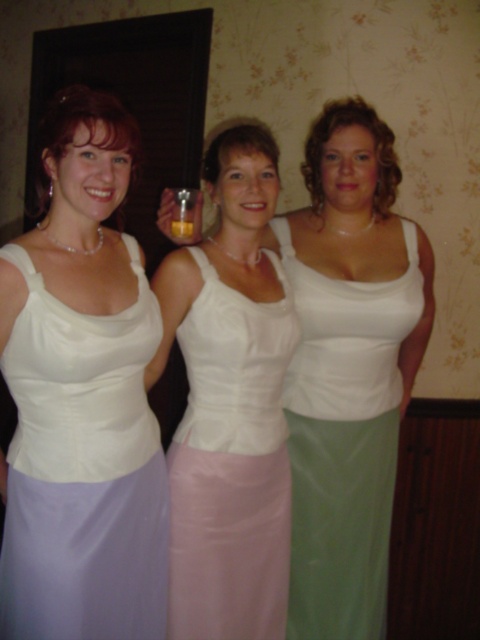
You are a photographer at an event and need to adjust the lighting between the white satin dress at center and the satin white dress at center. Since they are very close, will you need to make a significant adjustment to the lighting setup?

The white satin dress at center is only 8.86 inches from the satin white dress at center, so the distance is small. Therefore, minimal adjustments to the lighting setup would be needed to accommodate both dresses.

You are a photographer adjusting your camera to focus on the matte white tank top at center and the matte white dress at left. Which one should you focus on first to ensure it appears sharp in the photo?

The matte white tank top at center should be focused on first because it is closer to the viewer than the matte white dress at left, ensuring it appears sharp.

You are a photographer setting up a shot for a fashion event. You notice two dresses in the scene, the white satin dress at center and the satin white dress at center. Which dress has a wider silhouette?

The white satin dress at center has a wider silhouette than the satin white dress at center.